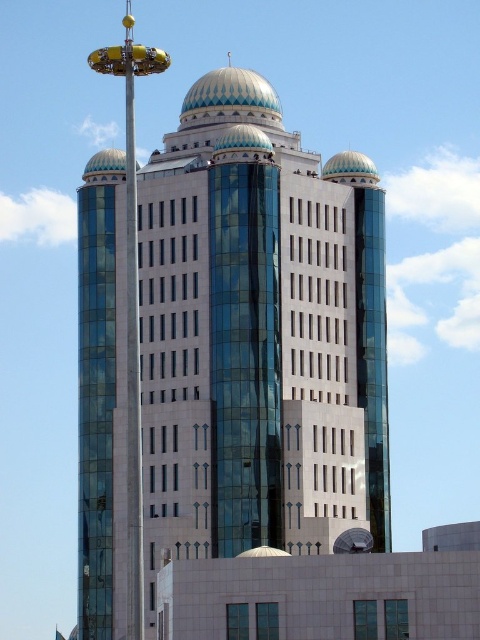
Question: In this image, where is gold metallic dome at upper left located relative to white glossy dome at center?

Choices:
 (A) below
 (B) above

Answer: (B)

Question: Which point is closer to the camera taking this photo?

Choices:
 (A) (336, 156)
 (B) (210, 83)
 (C) (135, 516)

Answer: (C)

Question: Which object appears closest to the camera in this image?

Choices:
 (A) matte glass dome at center
 (B) white glossy dome at center
 (C) metallic pole at center
 (D) blue-green mosaic dome at center

Answer: (C)

Question: Does matte glass dome at center have a lesser width compared to gold metallic dome at upper left?

Choices:
 (A) no
 (B) yes

Answer: (A)

Question: Which object is farther from the camera taking this photo?

Choices:
 (A) gold metallic dome at upper left
 (B) matte glass dome at center

Answer: (A)

Question: Can you confirm if white glossy dome at upper center is bigger than gold metallic dome at upper left?

Choices:
 (A) yes
 (B) no

Answer: (B)